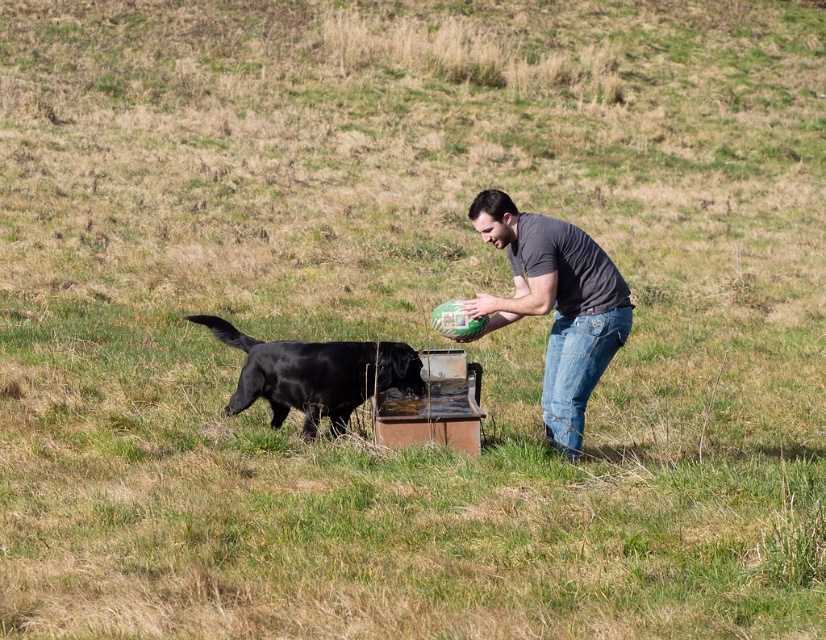
Is gray matte shirt at center positioned before black glossy fur at left?

That is True.

Which is above, gray matte shirt at center or black glossy fur at left?

gray matte shirt at center is higher up.

The image size is (826, 640). What do you see at coordinates (556, 305) in the screenshot? I see `gray matte shirt at center` at bounding box center [556, 305].

The height and width of the screenshot is (640, 826). Identify the location of gray matte shirt at center. (556, 305).